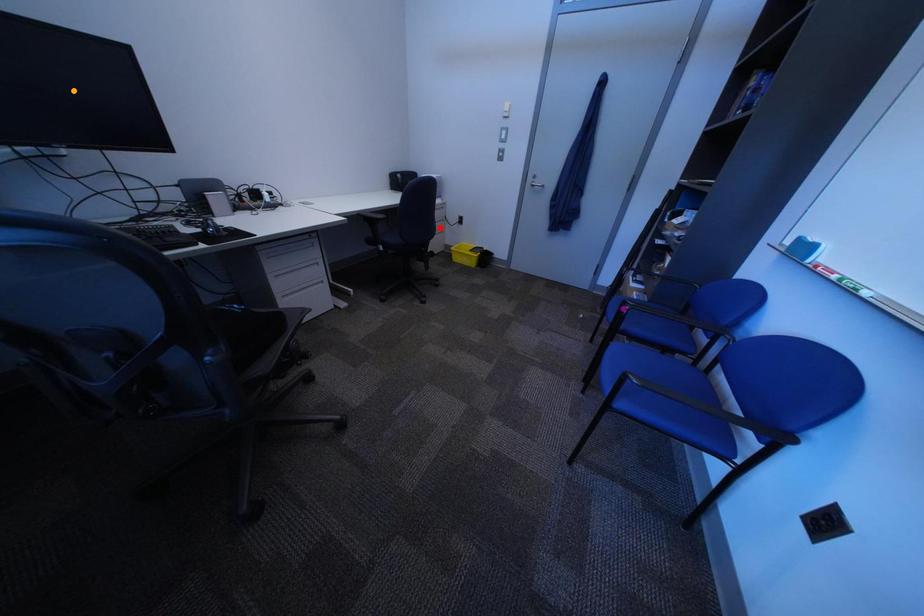
Order these from nearest to farthest:
purple point, red point, orange point

orange point < purple point < red point